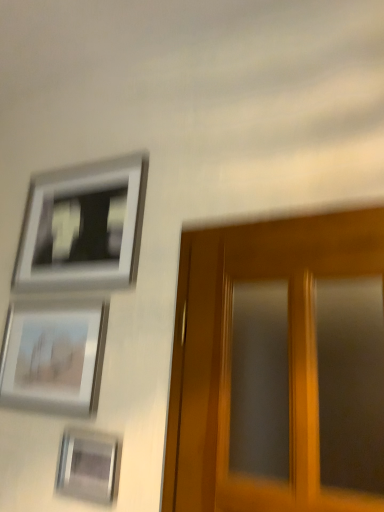
Question: From the image's perspective, does silver metallic picture frame at upper left, which is the first picture frame from top to bottom, appear lower than metallic silver picture frame at lower left, the 1th picture frame ordered from the bottom?

Choices:
 (A) yes
 (B) no

Answer: (B)

Question: Does silver metallic picture frame at upper left, which is the third picture frame from bottom to top, appear on the left side of metallic silver picture frame at lower left, the 1th picture frame ordered from the bottom?

Choices:
 (A) no
 (B) yes

Answer: (B)

Question: Can you confirm if silver metallic picture frame at upper left, which is the first picture frame from top to bottom, is thinner than metallic silver picture frame at lower left, the 1th picture frame ordered from the bottom?

Choices:
 (A) yes
 (B) no

Answer: (B)

Question: Is silver metallic picture frame at upper left, which is the first picture frame from top to bottom, positioned behind metallic silver picture frame at lower left, the 1th picture frame ordered from the bottom?

Choices:
 (A) yes
 (B) no

Answer: (A)

Question: From the image's perspective, is silver metallic picture frame at upper left, which is the first picture frame from top to bottom, on metallic silver picture frame at lower left, positioned as the third picture frame in top-to-bottom order?

Choices:
 (A) no
 (B) yes

Answer: (B)

Question: Which is correct: metallic silver picture frame at lower left, the 1th picture frame ordered from the bottom, is inside silver metallic picture frame at upper left, which is the third picture frame from bottom to top, or outside of it?

Choices:
 (A) outside
 (B) inside

Answer: (A)

Question: Relative to silver metallic picture frame at upper left, which is the first picture frame from top to bottom, is metallic silver picture frame at lower left, positioned as the third picture frame in top-to-bottom order, in front or behind?

Choices:
 (A) front
 (B) behind

Answer: (A)

Question: Looking at the image, does metallic silver picture frame at lower left, the 1th picture frame ordered from the bottom, seem bigger or smaller compared to silver metallic picture frame at upper left, which is the third picture frame from bottom to top?

Choices:
 (A) small
 (B) big

Answer: (A)

Question: Is metallic silver picture frame at lower left, positioned as the third picture frame in top-to-bottom order, wider or thinner than silver metallic picture frame at upper left, which is the third picture frame from bottom to top?

Choices:
 (A) thin
 (B) wide

Answer: (A)

Question: Is point (56, 175) positioned closer to the camera than point (61, 382)?

Choices:
 (A) closer
 (B) farther

Answer: (B)

Question: Based on their sizes in the image, would you say silver metallic picture frame at upper left, which is the third picture frame from bottom to top, is bigger or smaller than matte silver picture frame at lower left, the 2th picture frame when ordered from top to bottom?

Choices:
 (A) big
 (B) small

Answer: (A)

Question: Considering their positions, is silver metallic picture frame at upper left, which is the third picture frame from bottom to top, located in front of or behind matte silver picture frame at lower left, the 2th picture frame when ordered from top to bottom?

Choices:
 (A) front
 (B) behind

Answer: (B)

Question: Would you say silver metallic picture frame at upper left, which is the first picture frame from top to bottom, is to the left or to the right of matte silver picture frame at lower left, the 2th picture frame when ordered from top to bottom, in the picture?

Choices:
 (A) right
 (B) left

Answer: (A)

Question: From the image's perspective, relative to matte silver picture frame at lower left, the 2th picture frame when ordered from bottom to top, is metallic silver picture frame at lower left, positioned as the third picture frame in top-to-bottom order, above or below?

Choices:
 (A) above
 (B) below

Answer: (B)

Question: In terms of size, does metallic silver picture frame at lower left, positioned as the third picture frame in top-to-bottom order, appear bigger or smaller than matte silver picture frame at lower left, the 2th picture frame when ordered from top to bottom?

Choices:
 (A) big
 (B) small

Answer: (B)